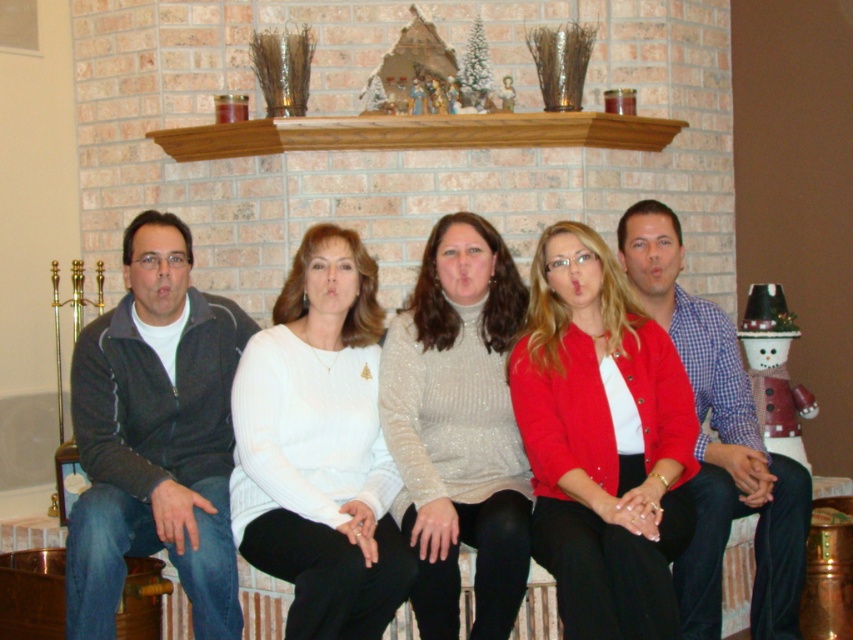
Does matte red cardigan at center have a larger size compared to white sweater at center?

Yes, matte red cardigan at center is bigger than white sweater at center.

Between matte red cardigan at center and white sweater at center, which one appears on the right side from the viewer's perspective?

From the viewer's perspective, matte red cardigan at center appears more on the right side.

Is point (633, 387) positioned behind point (242, 449)?

Yes.

Locate an element on the screen. This screenshot has width=853, height=640. matte red cardigan at center is located at coordinates (602, 442).

Who is more distant from viewer, (347, 483) or (720, 445)?

Point (720, 445)

Does point (354, 330) lie behind point (780, 464)?

No, it is not.

Find the location of `white sweater at center`. white sweater at center is located at coordinates (318, 448).

Which is in front, point (555, 312) or point (712, 333)?

Point (555, 312) is in front.

Image resolution: width=853 pixels, height=640 pixels. Identify the location of matte red cardigan at center. (602, 442).